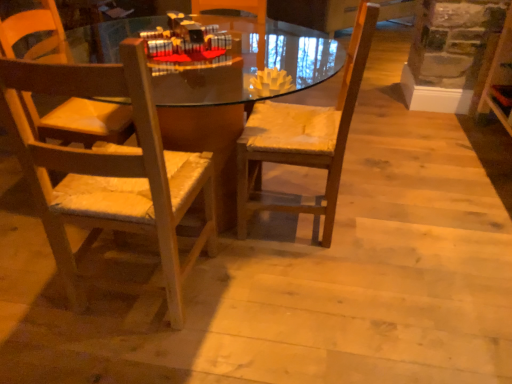
Identify the location of free space that is in between wooden chair with woven seat cushion at left, the second chair positioned from the right, and matte wood desk at center. (160, 310).